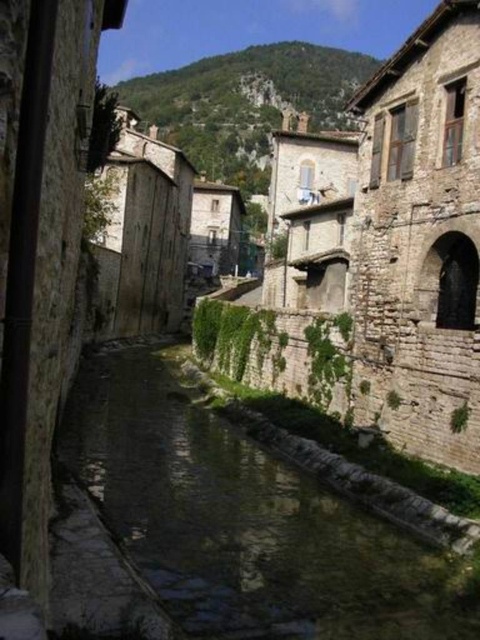
You are standing at the point labeled point (291, 102) in the image and want to walk to the point labeled point (237, 476). Given that the cobblestone street is only wide enough to allow movement in one direction, which direction should you face to reach your destination?

You should face forward since point (237, 476) is in front of point (291, 102), meaning it is along the direction you are facing.

You are standing at point (x=321, y=595) and want to cross the street to the other side. The stream in the center is 136.81 feet wide. If your maximum jump distance is 10 feet, can you safely jump across the stream?

The stream is 136.81 feet wide, which is much wider than your maximum jump distance of 10 feet. Therefore, you cannot safely jump across the stream.

Based on the photo, you are standing at the entrance of the cobblestone street and want to cross to the other side. The green mossy stone stream at center is in your way. Where is the stream located relative to your position?

The green mossy stone stream at center is located at coordinates point (243, 522), so it is positioned to your right side as you face the street.